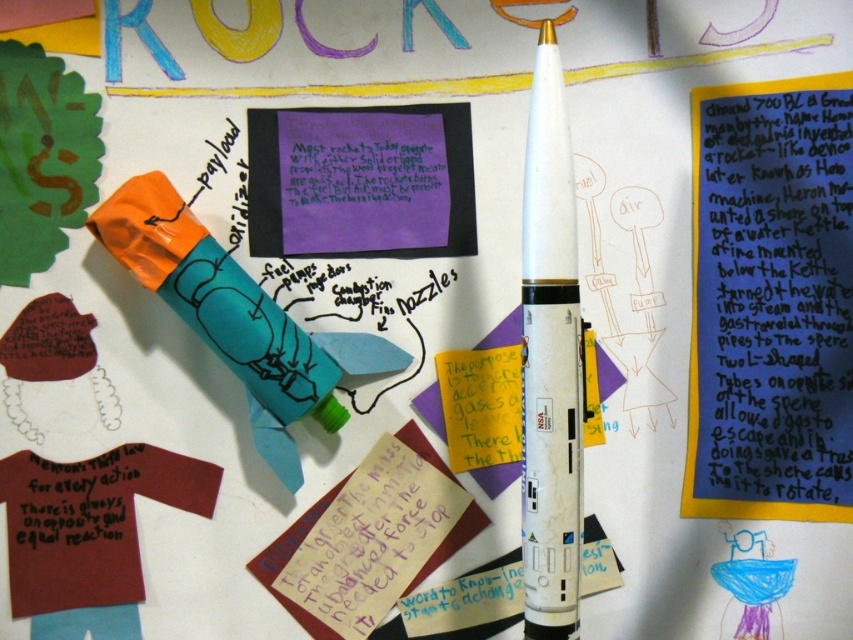
Is matte purple paper at upper right positioned behind white matte rocket at center?

Yes, it is behind white matte rocket at center.

You are a GUI agent. You are given a task and a screenshot of the screen. Output one action in this format:
    pyautogui.click(x=<x>, y=<y>)
    Task: Click on the matte purple paper at upper right
    Image resolution: width=853 pixels, height=640 pixels.
    Given the screenshot: What is the action you would take?
    pyautogui.click(x=770, y=301)